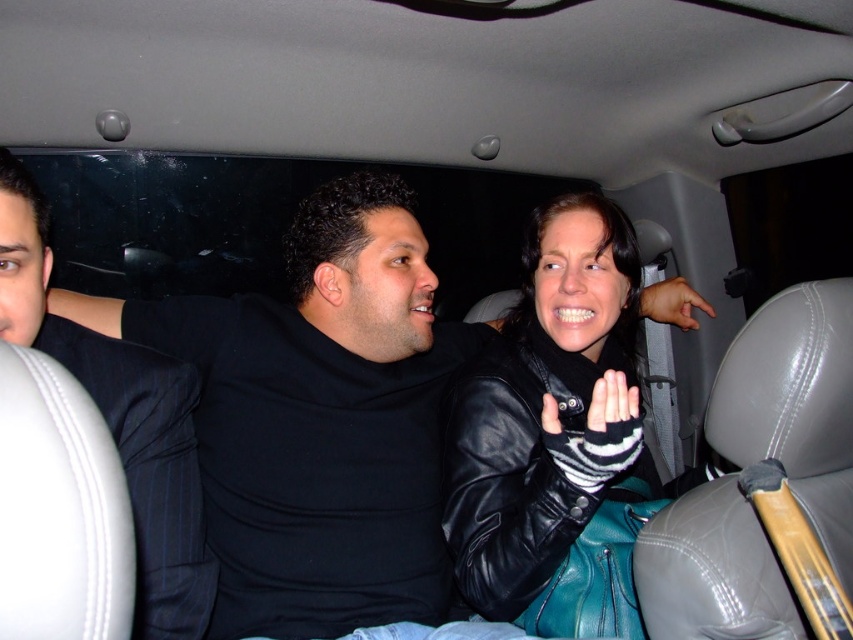
In the scene shown: Between black leather jacket at center and black leather hand at center, which one is positioned higher?

Positioned higher is black leather hand at center.

Can you confirm if black leather jacket at center is positioned above black leather hand at center?

No, black leather jacket at center is not above black leather hand at center.

Between point (509, 605) and point (679, 324), which one is positioned behind?

The point (679, 324) is behind.

The image size is (853, 640). In order to click on black leather jacket at center in this screenshot , I will do `click(558, 436)`.

Which of these two, black pinstripe suit at left or black leather hand at center, stands shorter?

black leather hand at center is shorter.

Does point (117, 371) come farther from viewer compared to point (665, 321)?

That is False.

Image resolution: width=853 pixels, height=640 pixels. I want to click on black pinstripe suit at left, so 119,417.

At what (x,y) coordinates should I click in order to perform the action: click on black pinstripe suit at left. Please return your answer as a coordinate pair (x, y). The width and height of the screenshot is (853, 640). Looking at the image, I should click on tap(119, 417).

Can you confirm if black leather jacket at center is taller than black pinstripe suit at left?

Yes, black leather jacket at center is taller than black pinstripe suit at left.

Can you confirm if black leather jacket at center is shorter than black pinstripe suit at left?

Incorrect, black leather jacket at center's height does not fall short of black pinstripe suit at left's.

What do you see at coordinates (558, 436) in the screenshot? The height and width of the screenshot is (640, 853). I see `black leather jacket at center` at bounding box center [558, 436].

The image size is (853, 640). Identify the location of black leather jacket at center. (558, 436).